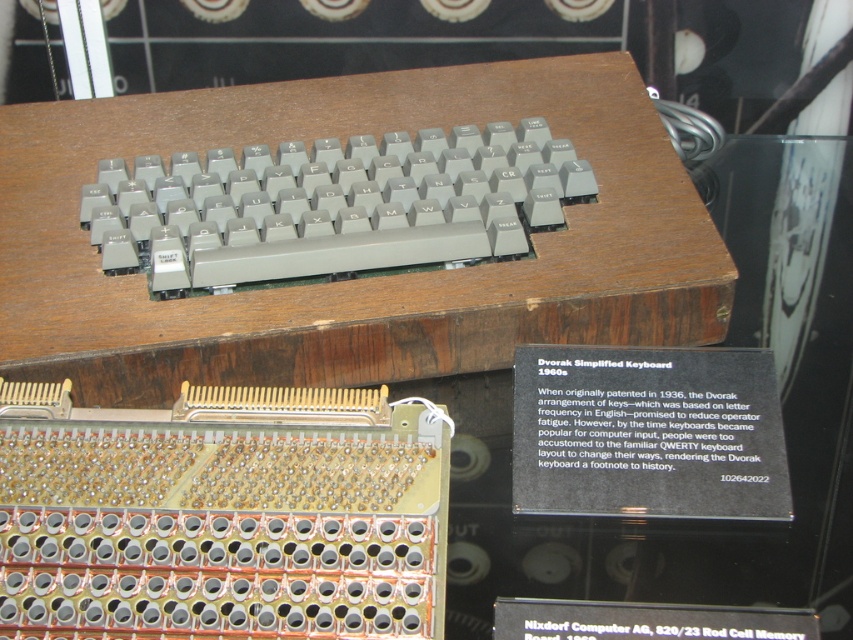
Question: Can you confirm if wooden table at center is positioned above gray plastic keyboard at upper center?

Choices:
 (A) no
 (B) yes

Answer: (A)

Question: Is the position of wooden table at center less distant than that of gray plastic keyboard at upper center?

Choices:
 (A) no
 (B) yes

Answer: (B)

Question: Is wooden table at center smaller than gray plastic keyboard at upper center?

Choices:
 (A) yes
 (B) no

Answer: (B)

Question: Among these points, which one is nearest to the camera?

Choices:
 (A) (90, 365)
 (B) (165, 285)

Answer: (A)